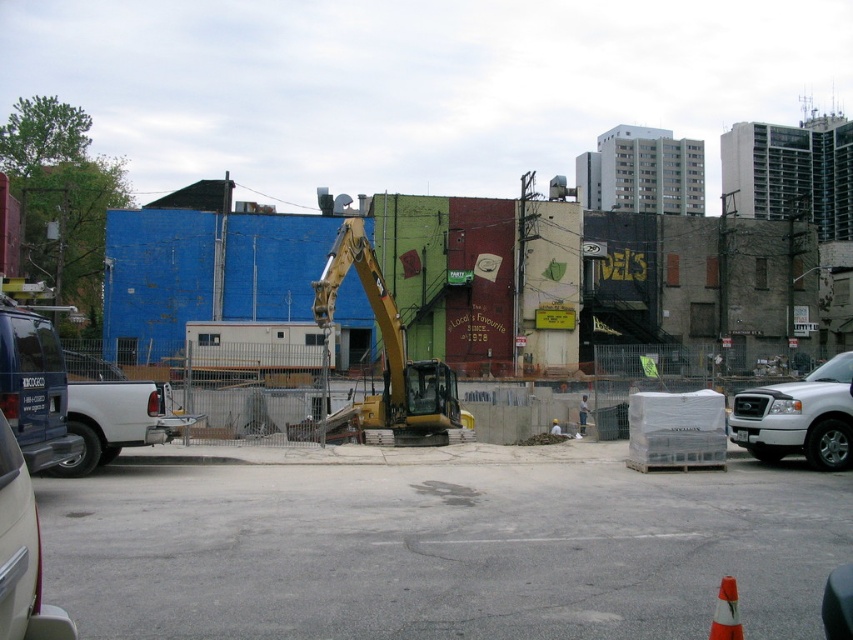
Can you confirm if yellow metallic excavator at center is positioned below white matte truck at right?

Incorrect, yellow metallic excavator at center is not positioned below white matte truck at right.

From the picture: Is yellow metallic excavator at center wider than white matte truck at right?

Correct, the width of yellow metallic excavator at center exceeds that of white matte truck at right.

What are the coordinates of `yellow metallic excavator at center` in the screenshot? It's located at (387, 355).

Consider the image. Can you confirm if matte blue van at left is bigger than white fabric construction worker at center?

Indeed, matte blue van at left has a larger size compared to white fabric construction worker at center.

Which is behind, point (28, 346) or point (552, 420)?

Point (552, 420)

Locate an element on the screen. This screenshot has width=853, height=640. matte blue van at left is located at coordinates (33, 387).

Does point (438, 365) lie in front of point (724, 621)?

That is False.

Does yellow metallic excavator at center have a greater width compared to orange reflective cone at lower right?

Indeed, yellow metallic excavator at center has a greater width compared to orange reflective cone at lower right.

Does point (386, 344) come in front of point (726, 584)?

No, it is behind (726, 584).

Where is `yellow metallic excavator at center`? The image size is (853, 640). yellow metallic excavator at center is located at coordinates (387, 355).